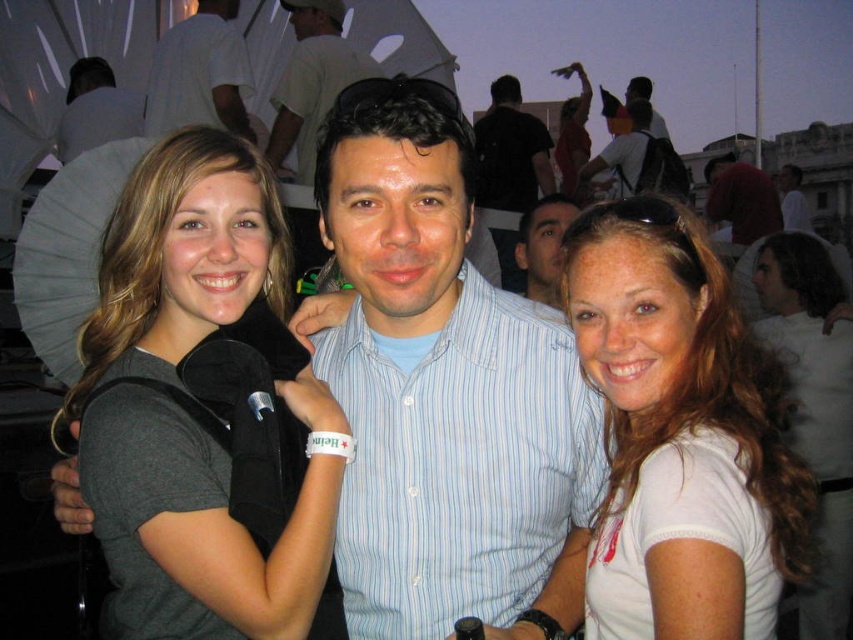
Question: Which point is farther from the camera taking this photo?

Choices:
 (A) (122, 252)
 (B) (229, 92)
 (C) (70, 86)

Answer: (C)

Question: Which point is farther to the camera?

Choices:
 (A) matte blue shirt at center
 (B) light blue striped shirt at center
 (C) blue striped shirt at center

Answer: (A)

Question: Which is nearer to the matte blue shirt at center?

Choices:
 (A) blue striped shirt at center
 (B) matte black shirt at upper center
 (C) dark blue shirt at center

Answer: (C)

Question: Does blue striped shirt at center have a lesser width compared to white shirt at center?

Choices:
 (A) no
 (B) yes

Answer: (A)

Question: Can you confirm if dark blue shirt at center is positioned above light blue striped shirt at center?

Choices:
 (A) yes
 (B) no

Answer: (A)

Question: Does matte blue shirt at center have a smaller size compared to matte black shirt at upper center?

Choices:
 (A) no
 (B) yes

Answer: (B)